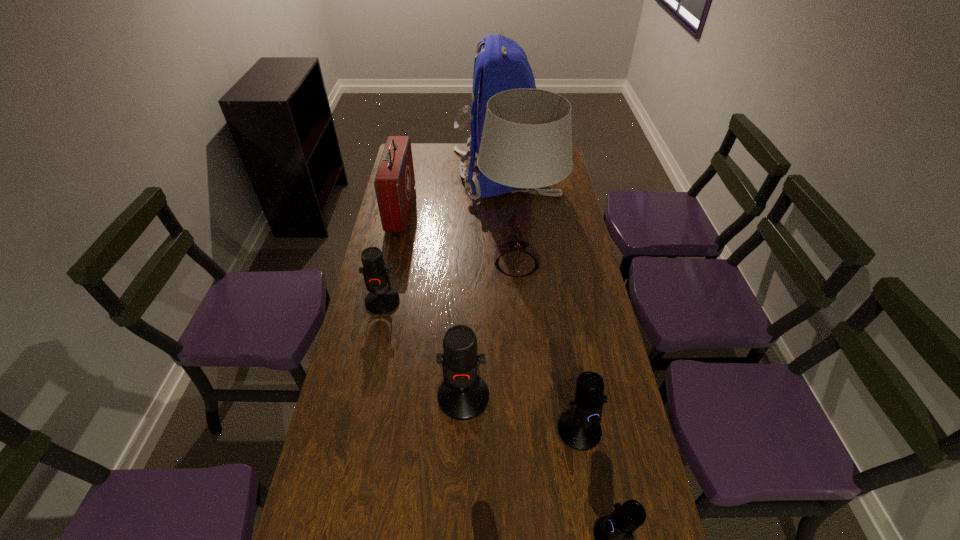
This screenshot has width=960, height=540. In order to click on backpack in this screenshot , I will do `click(502, 65)`.

Where is `table lamp`? The image size is (960, 540). table lamp is located at coordinates (526, 143).

This screenshot has height=540, width=960. I want to click on the first-aid kit, so click(394, 183).

I want to click on the tallest microphone, so click(463, 395).

Locate an element on the screen. This screenshot has height=540, width=960. the nearer red microphone is located at coordinates (463, 395).

Where is `the bigger black microphone`? The image size is (960, 540). the bigger black microphone is located at coordinates (579, 428).

Find the location of a particular element. This screenshot has height=540, width=960. the left red microphone is located at coordinates (381, 299).

Find the location of `the leftmost microphone`. the leftmost microphone is located at coordinates (381, 299).

Where is `free location located on the back of the blue backpack`? free location located on the back of the blue backpack is located at coordinates (414, 175).

Locate an element on the screen. This screenshot has height=540, width=960. vacant space situated 0.060m on the back of the blue backpack is located at coordinates (438, 175).